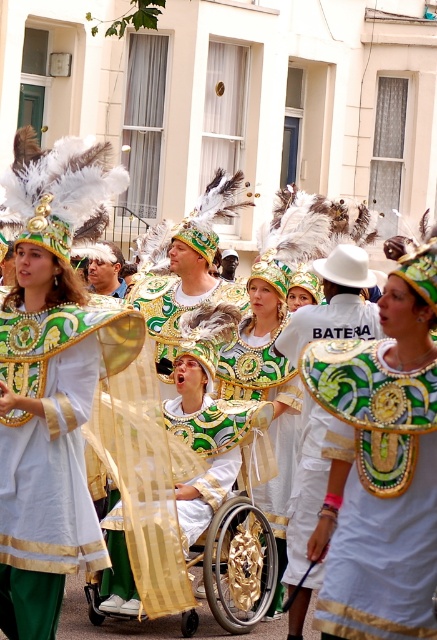
Is matte green fabric cape at center smaller than matte gold and green costume at center?

Actually, matte green fabric cape at center might be larger than matte gold and green costume at center.

Can you confirm if matte green fabric cape at center is thinner than matte gold and green costume at center?

Correct, matte green fabric cape at center's width is less than matte gold and green costume at center's.

Describe the element at coordinates (381, 465) in the screenshot. The width and height of the screenshot is (437, 640). I see `matte green fabric cape at center` at that location.

Locate an element on the screen. The width and height of the screenshot is (437, 640). matte green fabric cape at center is located at coordinates (381, 465).

Between matte green fabric cape at center and gold metallic wheelchair at center, which one has less height?

Standing shorter between the two is gold metallic wheelchair at center.

Describe the element at coordinates (381, 465) in the screenshot. I see `matte green fabric cape at center` at that location.

Does point (335, 364) come closer to viewer compared to point (277, 564)?

Yes, point (335, 364) is closer to viewer.

Where is `matte green fabric cape at center`? The image size is (437, 640). matte green fabric cape at center is located at coordinates (381, 465).

Does metallic gold helmet at center have a greater height compared to gold metallic wheelchair at center?

Correct, metallic gold helmet at center is much taller as gold metallic wheelchair at center.

Which of these two, metallic gold helmet at center or gold metallic wheelchair at center, stands taller?

metallic gold helmet at center is taller.

Does point (281, 566) come behind point (257, 557)?

Yes, point (281, 566) is behind point (257, 557).

In order to click on metallic gold helmet at center in this screenshot , I will do `click(267, 394)`.